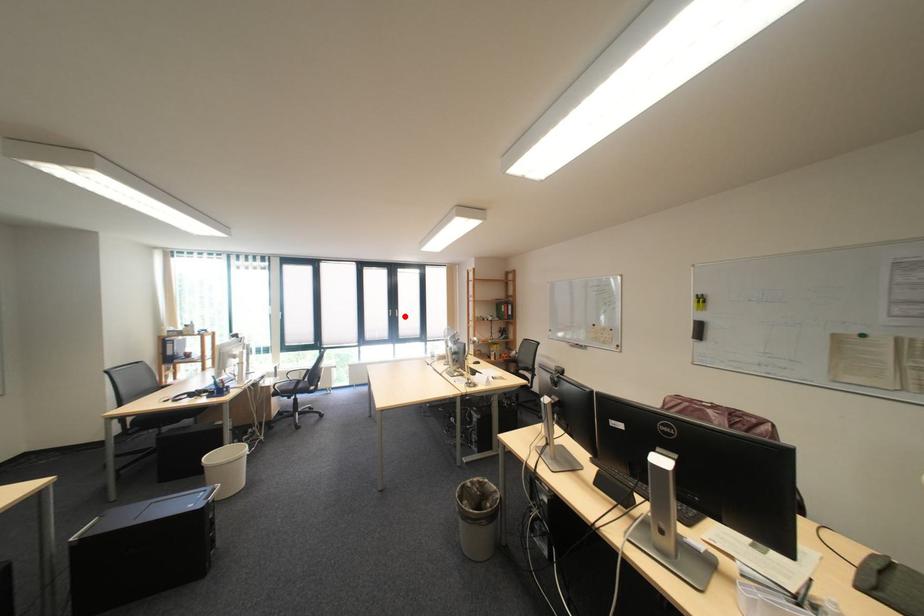
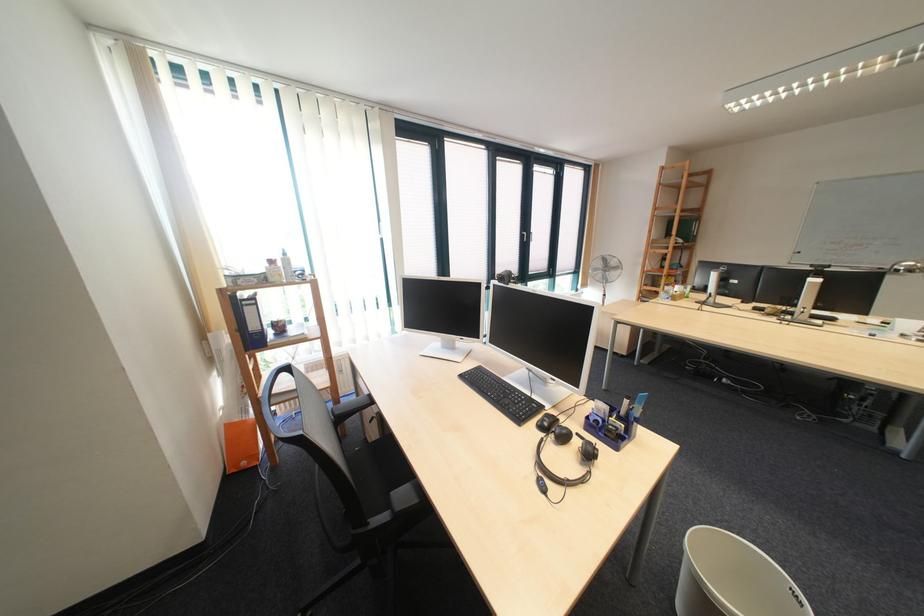
In the second image, find the point that corresponds to the highlighted location in the first image.

(540, 241)